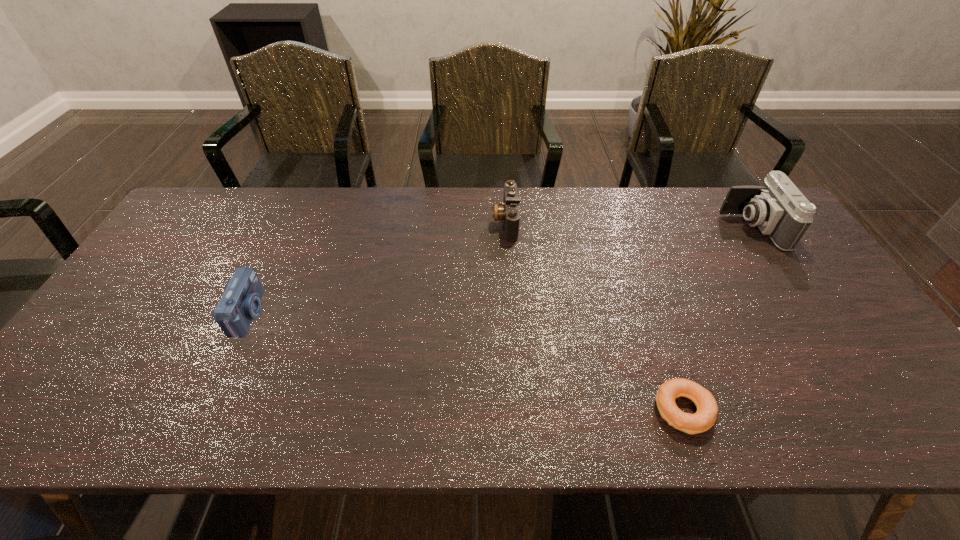
The width and height of the screenshot is (960, 540). I want to click on unoccupied area between the shortest object and the leftmost object, so click(467, 362).

Find the location of `empty space between the leftmost object and the rightmost camera`. empty space between the leftmost object and the rightmost camera is located at coordinates (500, 271).

Locate an element on the screen. The height and width of the screenshot is (540, 960). unoccupied area between the nearest camera and the nearest object is located at coordinates (467, 362).

Identify the location of object that is the third closest one to the nearest object. The height and width of the screenshot is (540, 960). (240, 303).

Where is `object that stands as the second closest to the third object from right to left`? The image size is (960, 540). object that stands as the second closest to the third object from right to left is located at coordinates (240, 303).

The image size is (960, 540). In order to click on camera that is the nearest to the rightmost object in this screenshot , I will do 509,212.

Locate which camera is the second closest to the tallest camera. Please provide its 2D coordinates. Your answer should be formatted as a tuple, i.e. [(x, y)], where the tuple contains the x and y coordinates of a point satisfying the conditions above.

[(240, 303)]

Where is `free region that satisfies the following two spatial constraints: 1. on the front-facing side of the second object from left to right; 2. on the right side of the nearest object`? The image size is (960, 540). free region that satisfies the following two spatial constraints: 1. on the front-facing side of the second object from left to right; 2. on the right side of the nearest object is located at coordinates (517, 410).

Identify the location of free space that satisfies the following two spatial constraints: 1. on the front-facing side of the bagel; 2. on the left side of the second object from left to right. This screenshot has width=960, height=540. (517, 410).

Identify the location of free space in the image that satisfies the following two spatial constraints: 1. on the front-facing side of the second object from left to right; 2. on the right side of the bagel. This screenshot has width=960, height=540. (517, 410).